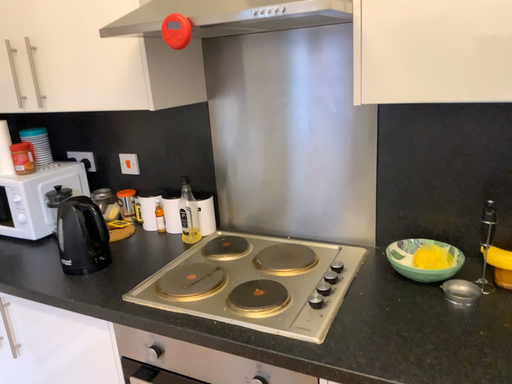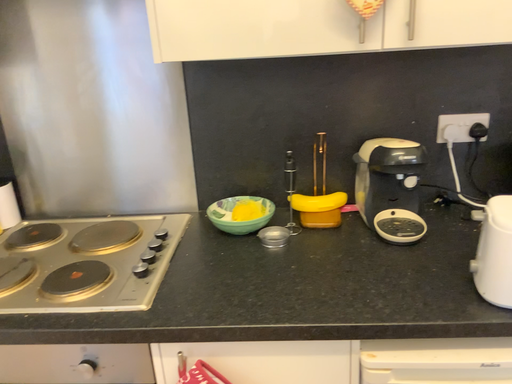
Question: Which way did the camera rotate in the video?

Choices:
 (A) rotated left
 (B) rotated right

Answer: (B)